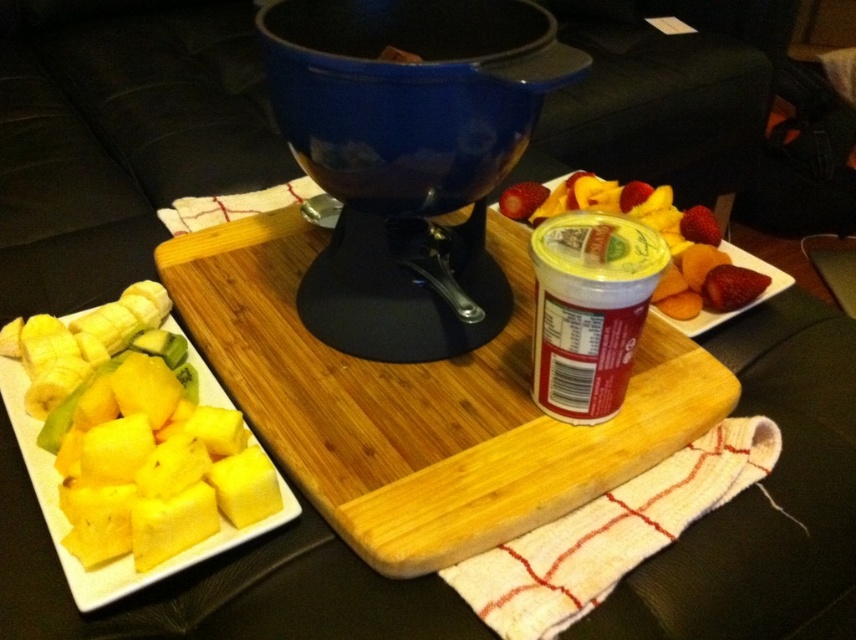
Question: Which of the following is the farthest from the observer?

Choices:
 (A) (521, 202)
 (B) (90, 586)
 (C) (578, 410)

Answer: (A)

Question: In this image, where is yellow matte pineapple at center located relative to red matte strawberry at center?

Choices:
 (A) above
 (B) below

Answer: (B)

Question: Is wooden cutting board at center wider than white creamy yogurt at center?

Choices:
 (A) yes
 (B) no

Answer: (A)

Question: Which point appears farthest from the camera in this image?

Choices:
 (A) (539, 342)
 (B) (542, 464)
 (C) (214, 404)
 (D) (520, 182)

Answer: (D)

Question: Can you confirm if wooden cutting board at center is positioned below white creamy yogurt at center?

Choices:
 (A) yes
 (B) no

Answer: (B)

Question: Which object appears farthest from the camera in this image?

Choices:
 (A) red matte strawberry at center
 (B) wooden cutting board at center

Answer: (A)